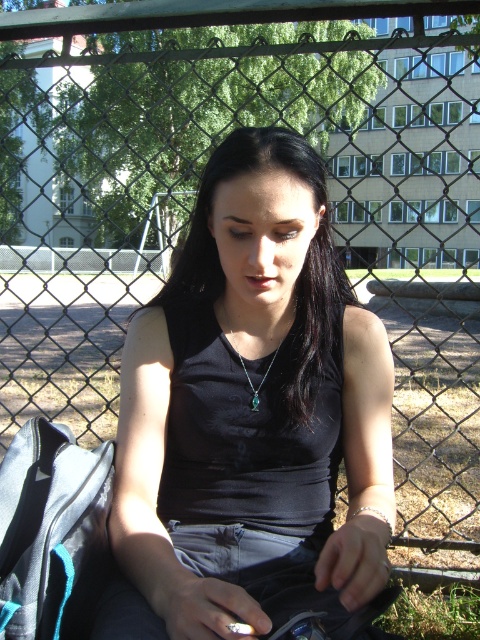
Based on the photo, you are a photographer setting up a shot of the person in the scene. You want to ensure the black matte tank top at center and the green grass at lower right are both in focus. If your camera has a depth of field that can cover 70 centimeters, will both objects be in focus?

The black matte tank top at center is 71.46 centimeters from the green grass at lower right. Since the distance between them is slightly over 70 centimeters, the camera might struggle to keep both in focus, so adjusting the settings or position could help.

You are a hiker who has just found an emerald green gemstone at center and wants to place it on the green grass at lower right. Based on the scene, can you confirm if the gemstone is currently above or below the grass?

The green grass at lower right is located below the emerald green gemstone at center, so the gemstone is currently above the grass.